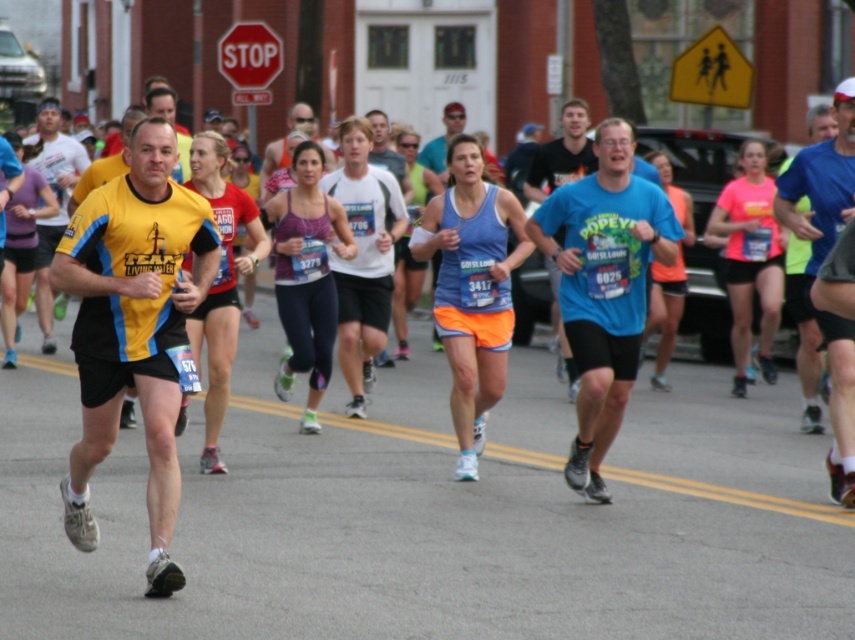
You are a photographer at the marathon event. You need to capture a photo of both the yellow fabric shirt at center and the matte blue tank top at center. Which runner should you focus on first to ensure both are in the frame?

The yellow fabric shirt at center is bigger than the matte blue tank top at center, so you should focus on the yellow fabric shirt at center first to ensure both are in the frame.

You are a runner in the marathon and you see two points marked on the road ahead. The first point is at point (348,195) and the second point is at point (750,294). Which point should you reach first while running forward?

You should reach point (348,195) first because it is in front of point (750,294) along your running path.

You are a photographer positioned at the origin of the image. You want to capture a photo of the white matte tank top at center. What are the coordinates where you should aim your camera?

The white matte tank top at center is located at point coordinates (363, 257), so you should aim your camera at those coordinates to capture it.